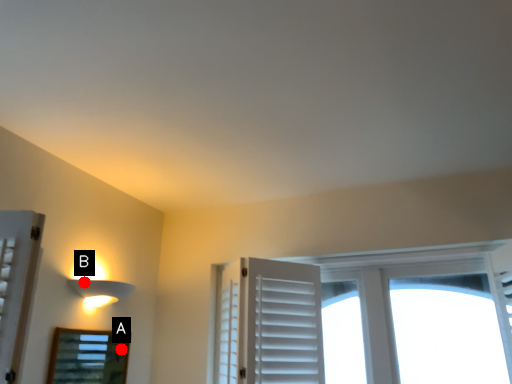
Question: Two points are circled on the image, labeled by A and B beside each circle. Which of the following is the closest to the observer?

Choices:
 (A) A is closer
 (B) B is closer

Answer: (B)